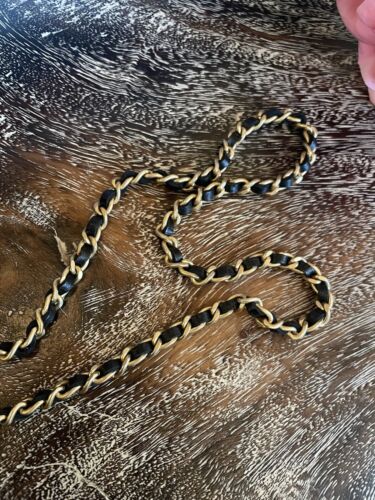
The height and width of the screenshot is (500, 375). In order to click on dark brown on table in this screenshot , I will do (62, 431), (46, 458), (35, 476), (167, 479), (145, 469), (106, 391), (135, 380), (102, 316), (11, 178), (63, 223).